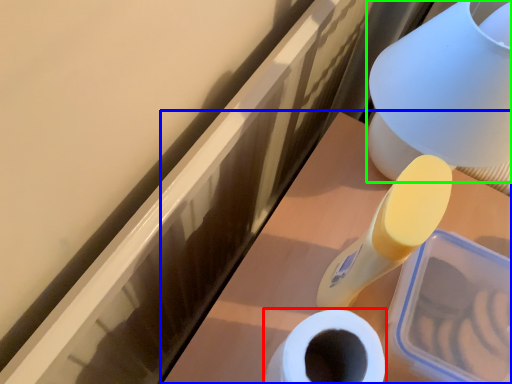
Question: Which object is the closest to the toilet paper (highlighted by a red box)? Choose among these: vanity (highlighted by a blue box) or table lamp (highlighted by a green box).

Choices:
 (A) vanity
 (B) table lamp

Answer: (A)